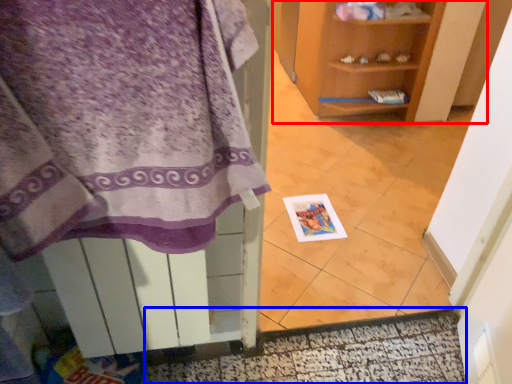
Question: Among these objects, which one is farthest to the camera, shelf (highlighted by a red box) or door (highlighted by a blue box)?

Choices:
 (A) shelf
 (B) door

Answer: (A)